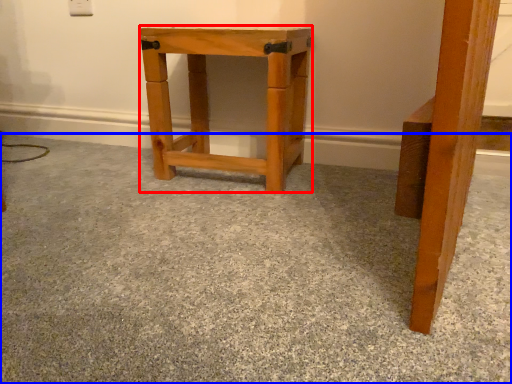
Question: Which object appears farthest to the camera in this image, stool (highlighted by a red box) or concrete (highlighted by a blue box)?

Choices:
 (A) stool
 (B) concrete

Answer: (A)